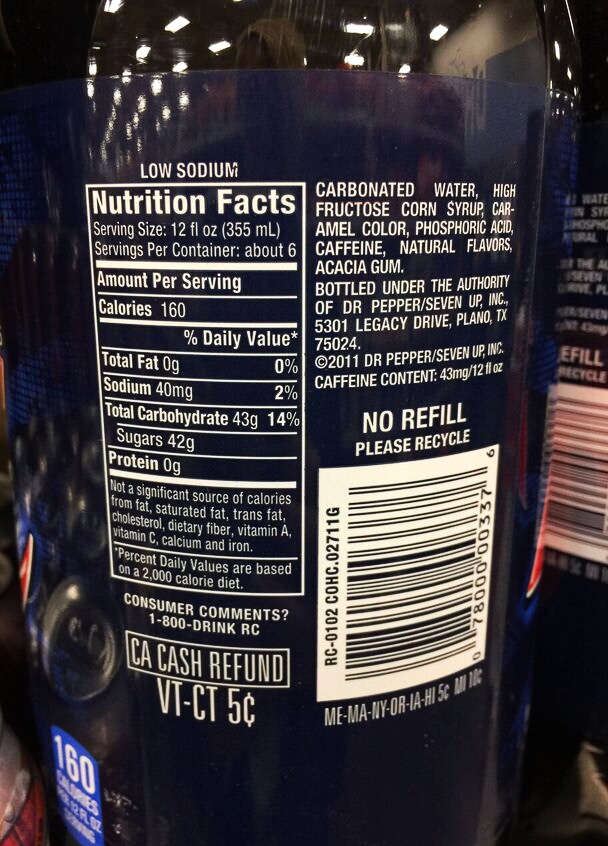
I want to click on wall, so (478, 40).